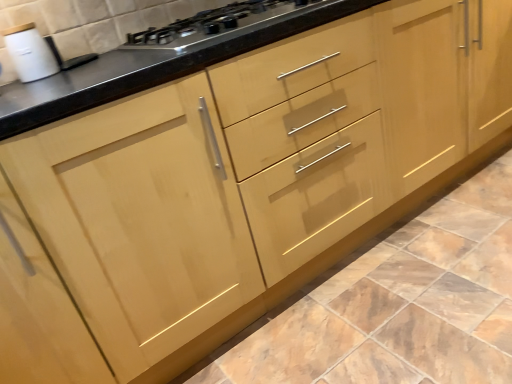
Question: Are satin black gas stove at upper center and matte brown cabinet at center beside each other?

Choices:
 (A) no
 (B) yes

Answer: (A)

Question: Is satin black gas stove at upper center not close to matte brown cabinet at center?

Choices:
 (A) yes
 (B) no

Answer: (B)

Question: Does satin black gas stove at upper center appear on the right side of matte brown cabinet at center?

Choices:
 (A) no
 (B) yes

Answer: (A)

Question: Is satin black gas stove at upper center taller than matte brown cabinet at center?

Choices:
 (A) no
 (B) yes

Answer: (B)

Question: Considering the relative sizes of satin black gas stove at upper center and matte brown cabinet at center in the image provided, is satin black gas stove at upper center wider than matte brown cabinet at center?

Choices:
 (A) yes
 (B) no

Answer: (B)

Question: Considering the relative sizes of satin black gas stove at upper center and matte brown cabinet at center in the image provided, is satin black gas stove at upper center smaller than matte brown cabinet at center?

Choices:
 (A) no
 (B) yes

Answer: (B)

Question: Is white glossy sink at upper left a part of satin black gas stove at upper center?

Choices:
 (A) no
 (B) yes

Answer: (A)

Question: Considering the relative sizes of satin black gas stove at upper center and white glossy sink at upper left in the image provided, is satin black gas stove at upper center thinner than white glossy sink at upper left?

Choices:
 (A) no
 (B) yes

Answer: (A)

Question: Is satin black gas stove at upper center positioned far away from white glossy sink at upper left?

Choices:
 (A) yes
 (B) no

Answer: (B)

Question: Is satin black gas stove at upper center at the left side of white glossy sink at upper left?

Choices:
 (A) yes
 (B) no

Answer: (B)

Question: Considering the relative sizes of satin black gas stove at upper center and white glossy sink at upper left in the image provided, is satin black gas stove at upper center bigger than white glossy sink at upper left?

Choices:
 (A) no
 (B) yes

Answer: (B)

Question: Considering the relative sizes of satin black gas stove at upper center and white glossy sink at upper left in the image provided, is satin black gas stove at upper center taller than white glossy sink at upper left?

Choices:
 (A) yes
 (B) no

Answer: (B)

Question: Does matte brown cabinet at center have a lesser width compared to satin black gas stove at upper center?

Choices:
 (A) no
 (B) yes

Answer: (A)